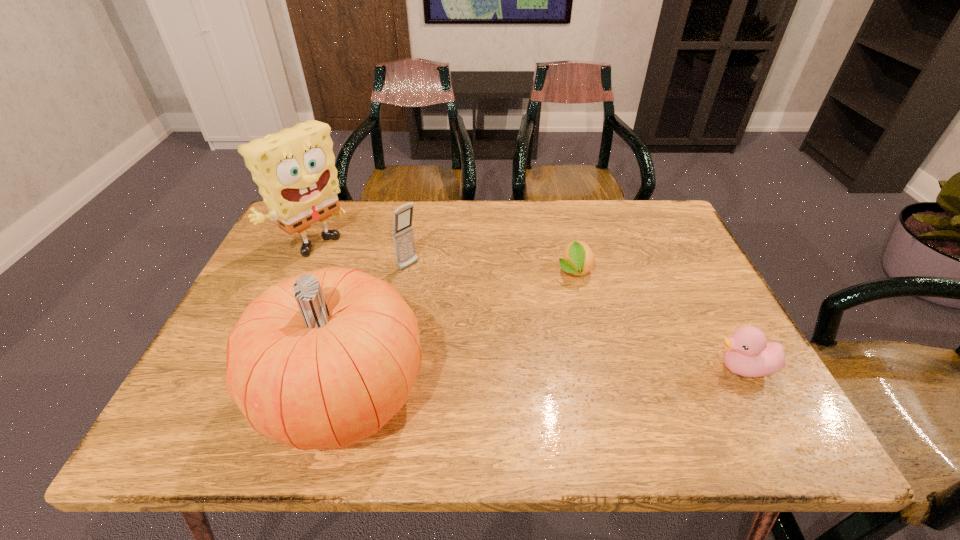
This screenshot has height=540, width=960. In order to click on free space located 0.270m with leaves positioned above the second object from right to left in this screenshot , I will do `click(589, 377)`.

Image resolution: width=960 pixels, height=540 pixels. What are the coordinates of `object that is at the far edge` in the screenshot? It's located at (295, 170).

Where is `pumpkin located at the near edge`? This screenshot has width=960, height=540. pumpkin located at the near edge is located at coordinates (323, 360).

Where is `duckling located at the near edge`? The width and height of the screenshot is (960, 540). duckling located at the near edge is located at coordinates (747, 353).

You are a GUI agent. You are given a task and a screenshot of the screen. Output one action in this format:
    pyautogui.click(x=<x>, y=<y>)
    Task: Click on the pumpkin located at the left edge
    The width and height of the screenshot is (960, 540).
    Given the screenshot: What is the action you would take?
    pyautogui.click(x=323, y=360)

In order to click on sponge at the left edge in this screenshot , I will do `click(295, 170)`.

Find the location of a particular element. object that is positioned at the right edge is located at coordinates (747, 353).

Find the location of a particular element. The image size is (960, 540). object present at the far left corner is located at coordinates (295, 170).

Where is `object that is at the near left corner`? Image resolution: width=960 pixels, height=540 pixels. object that is at the near left corner is located at coordinates (323, 360).

Locate an element on the screen. This screenshot has width=960, height=540. object that is at the near right corner is located at coordinates (747, 353).